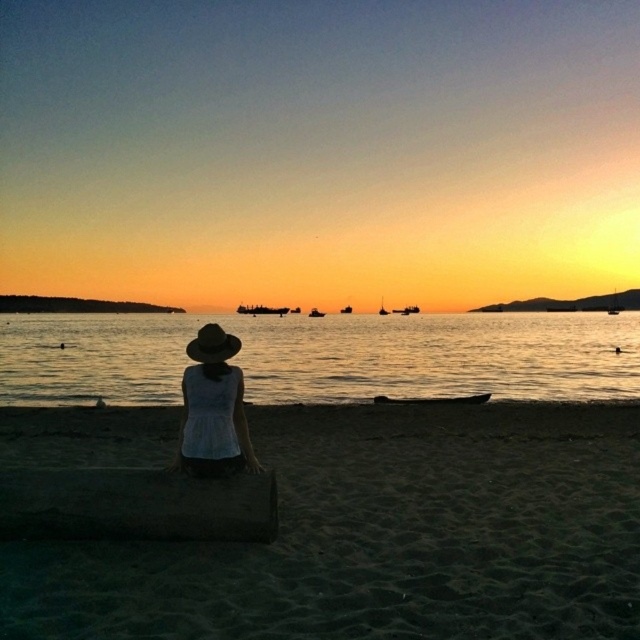
Does translucent water at center have a smaller size compared to metallic gray ship at center?

Incorrect, translucent water at center is not smaller in size than metallic gray ship at center.

Consider the image. Who is shorter, translucent water at center or metallic gray ship at center?

metallic gray ship at center is shorter.

The width and height of the screenshot is (640, 640). Find the location of `translucent water at center`. translucent water at center is located at coordinates (323, 356).

Can you confirm if metallic gray ship at center is wider than metallic silver boat at center?

Yes.

Is metallic gray ship at center bigger than metallic silver boat at center?

Indeed, metallic gray ship at center has a larger size compared to metallic silver boat at center.

Which is behind, point (268, 310) or point (314, 310)?

The point (268, 310) is behind.

The height and width of the screenshot is (640, 640). I want to click on metallic gray ship at center, so click(x=260, y=308).

Is sandy at lower center closer to camera compared to metallic silver boat at center?

That is True.

Is point (596, 618) behind point (314, 312)?

No, (596, 618) is in front of (314, 312).

Locate an element on the screen. sandy at lower center is located at coordinates (380, 536).